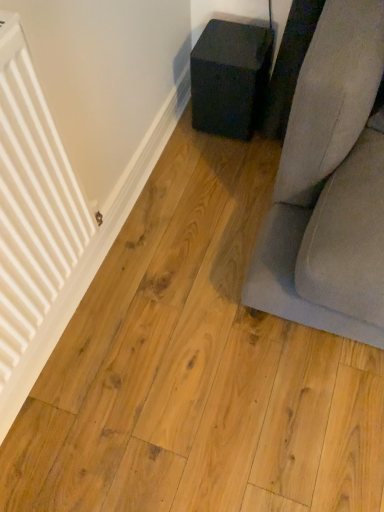
Question: Considering the positions of white matte radiator at left and matte black cube at center in the image, is white matte radiator at left taller or shorter than matte black cube at center?

Choices:
 (A) tall
 (B) short

Answer: (A)

Question: Considering the relative positions of white matte radiator at left and matte black cube at center in the image provided, is white matte radiator at left to the left or to the right of matte black cube at center?

Choices:
 (A) left
 (B) right

Answer: (A)

Question: Is white matte radiator at left inside or outside of matte black cube at center?

Choices:
 (A) inside
 (B) outside

Answer: (B)

Question: Considering their positions, is matte black cube at center located in front of or behind white matte radiator at left?

Choices:
 (A) front
 (B) behind

Answer: (B)

Question: Does point (210, 120) appear closer or farther from the camera than point (0, 212)?

Choices:
 (A) closer
 (B) farther

Answer: (B)

Question: Based on their positions, is matte black cube at center located to the left or right of white matte radiator at left?

Choices:
 (A) left
 (B) right

Answer: (B)

Question: From a real-world perspective, is matte black cube at center above or below white matte radiator at left?

Choices:
 (A) above
 (B) below

Answer: (B)